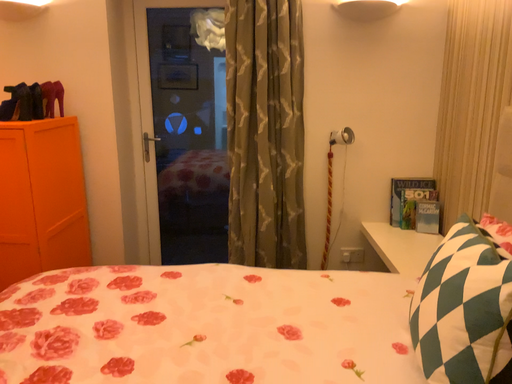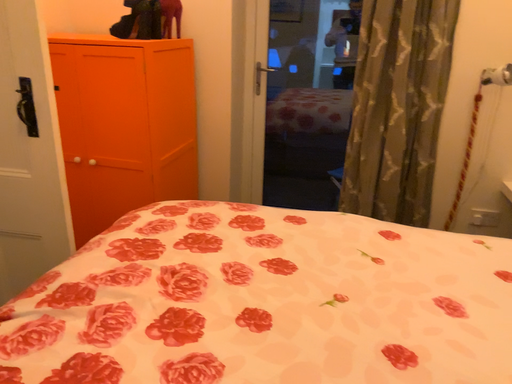
Question: How did the camera likely rotate when shooting the video?

Choices:
 (A) rotated upward
 (B) rotated downward

Answer: (B)